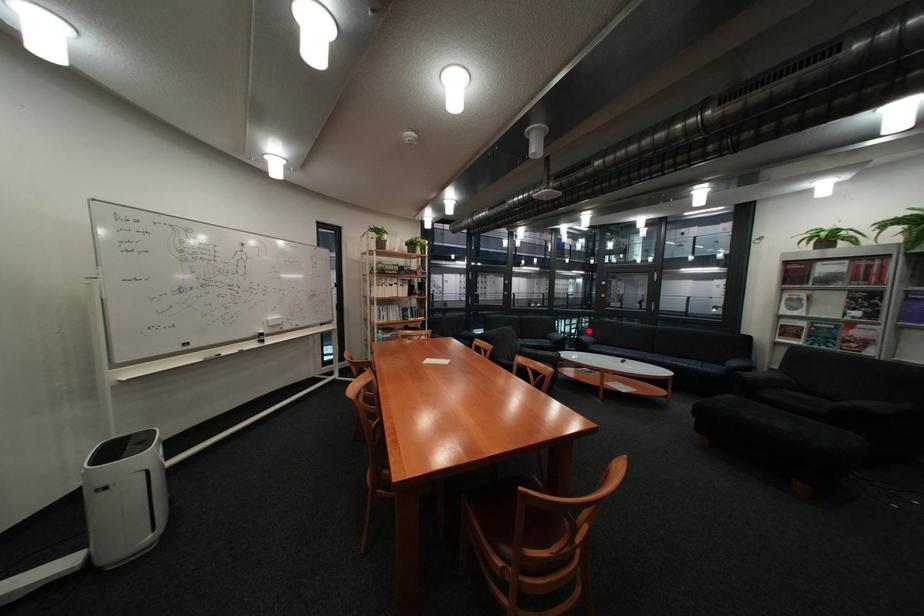
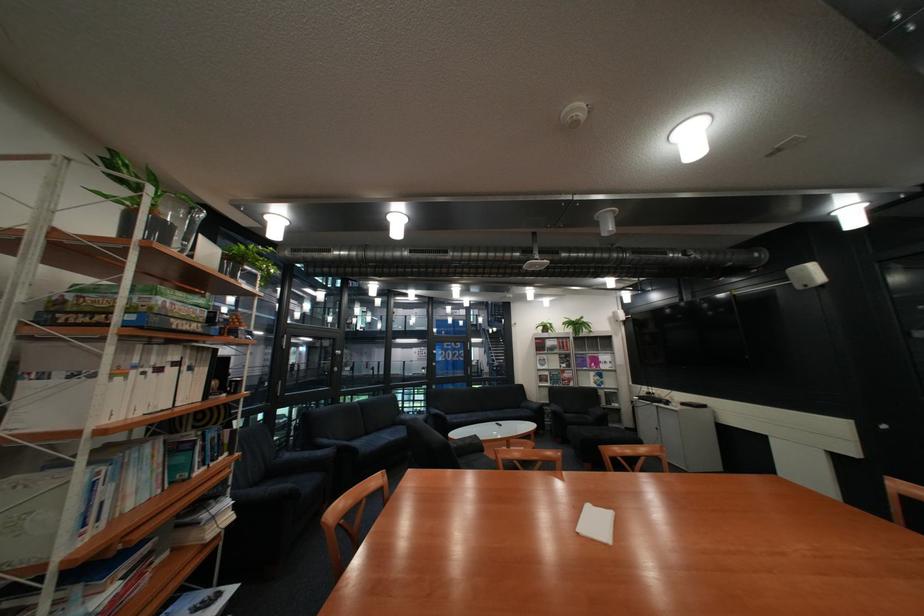
Find the pixel in the second image that matches the highlighted location in the first image.

(314, 411)